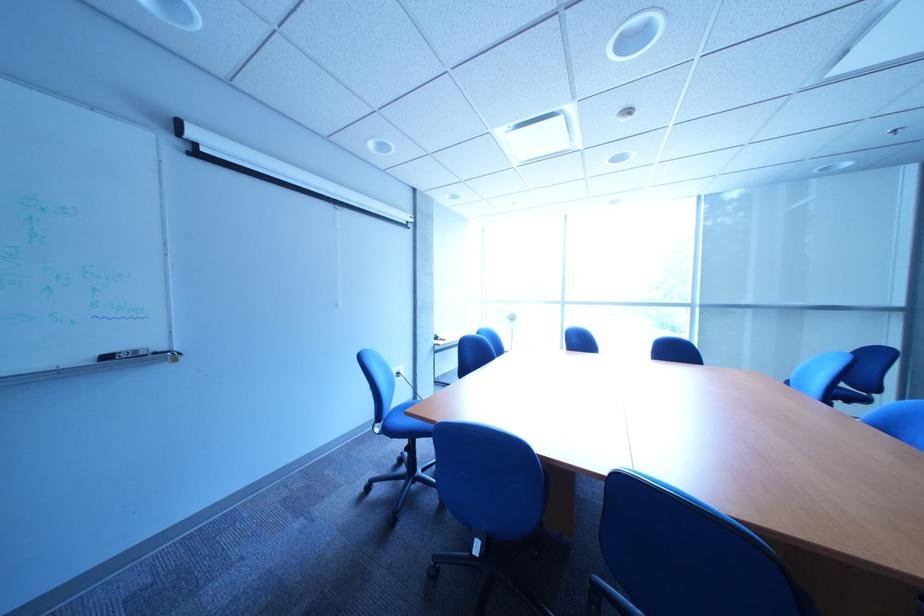
Find where to pull the projector screen handle. Please return your answer as a coordinate pair (x, y).

(540, 136)